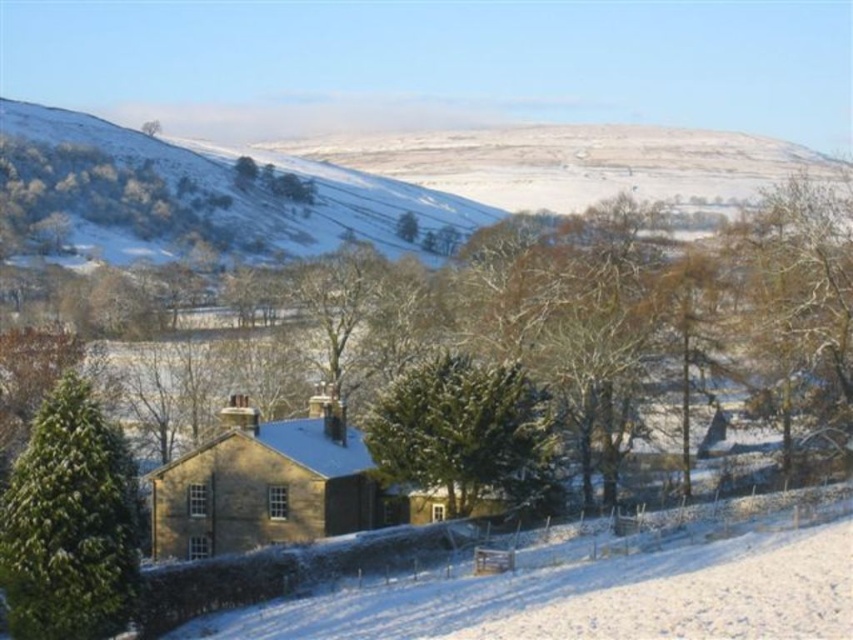
Question: Which of the following is the closest to the observer?

Choices:
 (A) snowy grassland at upper left
 (B) green textured evergreen at center

Answer: (B)

Question: Does snowy grassland at upper left have a larger size compared to green textured evergreen at center?

Choices:
 (A) no
 (B) yes

Answer: (B)

Question: Can you confirm if snowy grassland at upper left is positioned below green textured evergreen at center?

Choices:
 (A) yes
 (B) no

Answer: (B)

Question: Which point is farther from the camera taking this photo?

Choices:
 (A) (19, 504)
 (B) (115, 134)

Answer: (B)

Question: Which of these objects is positioned farthest from the green textured evergreen at center?

Choices:
 (A) green matte evergreen tree at center-left
 (B) snowy grassland at upper left

Answer: (B)

Question: Where is snowy grassland at upper left located in relation to green textured evergreen at center in the image?

Choices:
 (A) left
 (B) right

Answer: (A)